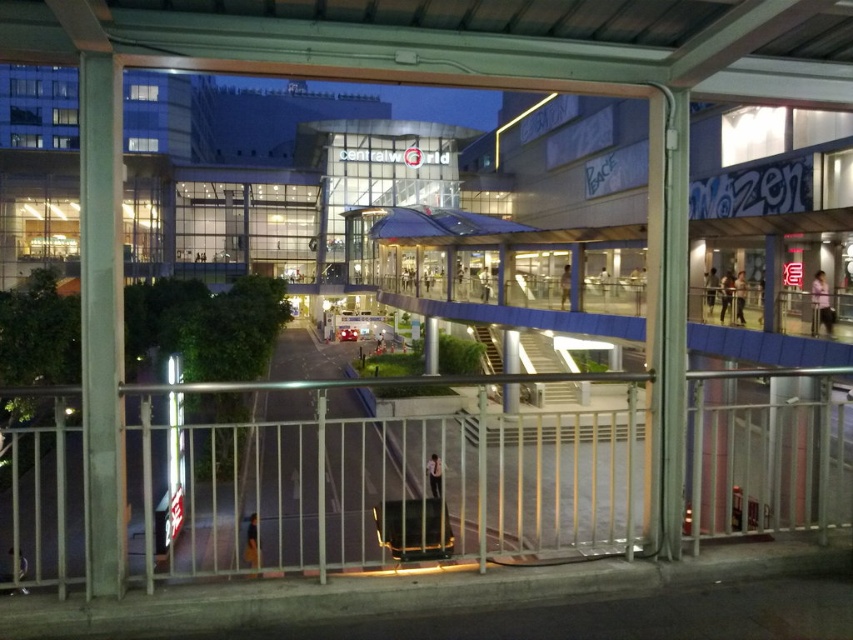
You are standing in front of the centralwOrld building at night. You see a metallic silver railing at center and a concrete pillar at left. Which object is closer to the entrance of the building?

The metallic silver railing at center is located below the concrete pillar at left, so the concrete pillar at left is closer to the entrance of the building.

You are standing in front of the centralwOrld building at night and want to lean on the metallic silver railing at center. Based on the coordinates provided, where exactly should you look to find the railing?

The metallic silver railing at center is located at point [379,486].

You are standing in front of the centralwOrld building at night and want to lean on the railing while taking a photo of the building. Can you safely lean on the metallic silver railing at center without hitting your head on the concrete pillar at left?

The metallic silver railing at center is shorter than the concrete pillar at left, so leaning on it should be safe as the pillar is taller and won